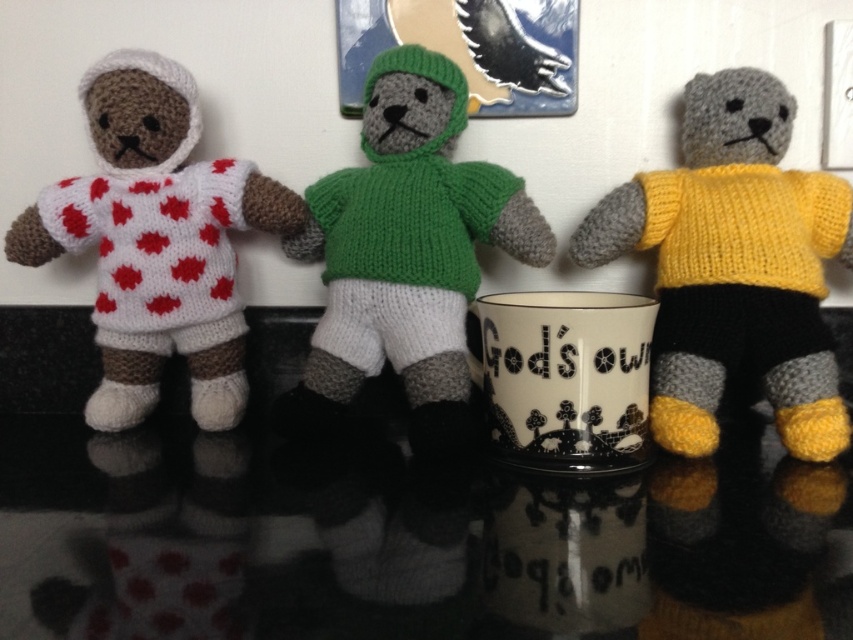
Who is taller, green knitted sweater at center or white knitted doll at left?

green knitted sweater at center

Which is more to the left, green knitted sweater at center or white knitted doll at left?

From the viewer's perspective, white knitted doll at left appears more on the left side.

Is point (450, 256) positioned behind point (158, 92)?

No.

Where is `green knitted sweater at center`? green knitted sweater at center is located at coordinates (405, 252).

Between point (757, 259) and point (120, 196), which one is positioned behind?

Positioned behind is point (120, 196).

Between yellow knitted sweater at center and white knitted doll at left, which one has more height?

white knitted doll at left is taller.

Does point (683, 435) lie behind point (250, 212)?

No, it is not.

Where is `yellow knitted sweater at center`? The image size is (853, 640). yellow knitted sweater at center is located at coordinates (734, 266).

Based on the photo, does yellow knitted sweater at center lie behind green knitted sweater at center?

Yes, it is.

Who is more distant from viewer, (792, 396) or (422, 326)?

Positioned behind is point (422, 326).

The image size is (853, 640). In order to click on yellow knitted sweater at center in this screenshot , I will do `click(734, 266)`.